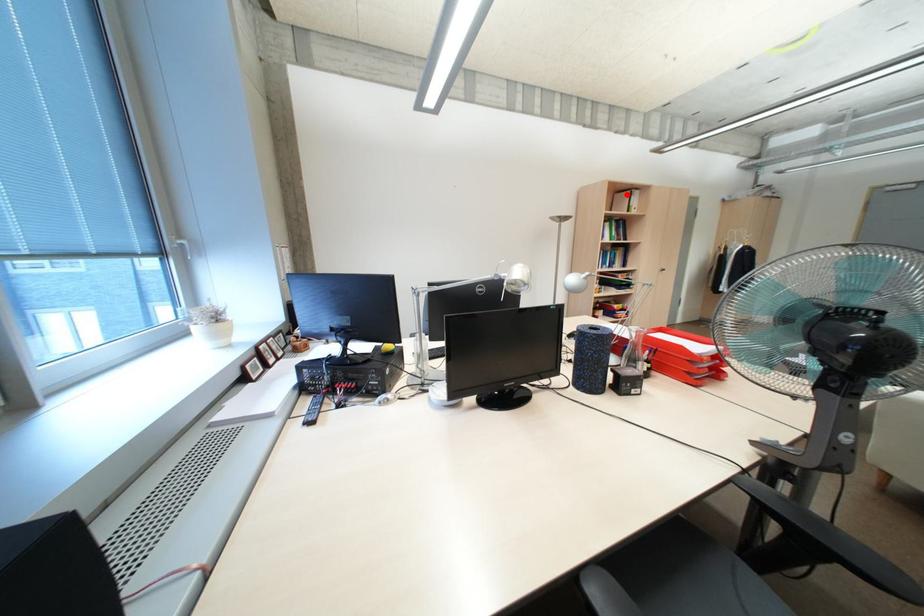
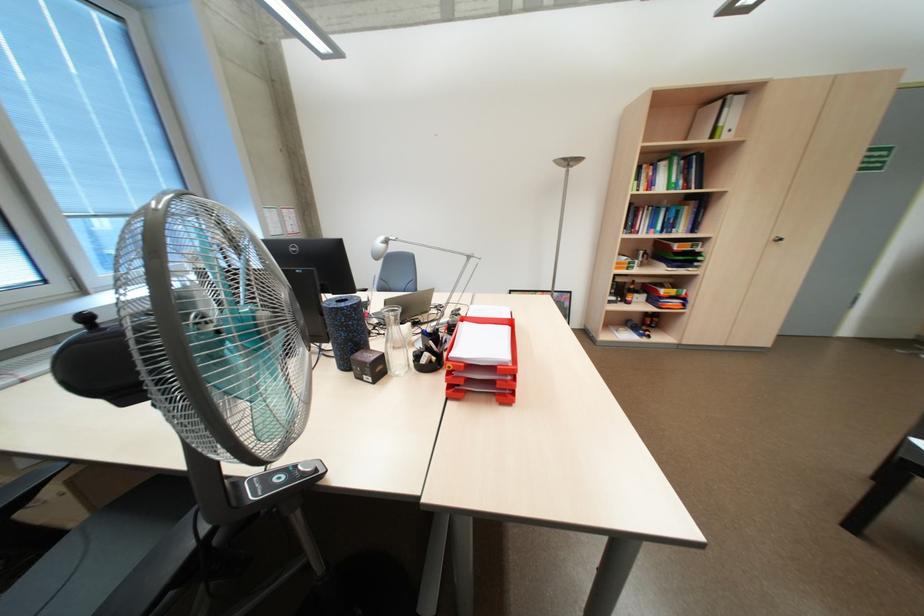
In the second image, find the point that corresponds to the highlighted location in the first image.

(711, 110)